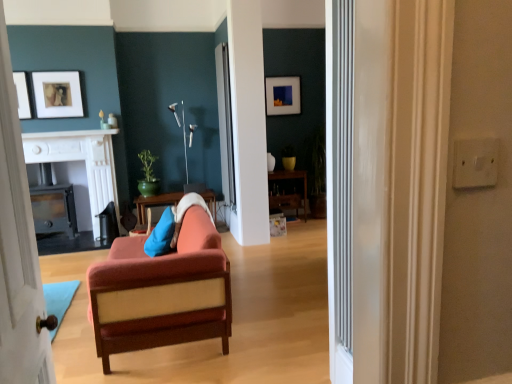
Question: Is clear glass door at center directly adjacent to white painted wood door at left?

Choices:
 (A) yes
 (B) no

Answer: (B)

Question: From the image's perspective, is clear glass door at center on white painted wood door at left?

Choices:
 (A) no
 (B) yes

Answer: (B)

Question: Does clear glass door at center have a greater height compared to white painted wood door at left?

Choices:
 (A) yes
 (B) no

Answer: (A)

Question: Considering the relative sizes of clear glass door at center and white painted wood door at left in the image provided, is clear glass door at center thinner than white painted wood door at left?

Choices:
 (A) yes
 (B) no

Answer: (A)

Question: From a real-world perspective, is clear glass door at center positioned under white painted wood door at left based on gravity?

Choices:
 (A) no
 (B) yes

Answer: (A)

Question: Does point (224, 264) appear closer or farther from the camera than point (84, 135)?

Choices:
 (A) farther
 (B) closer

Answer: (B)

Question: In the image, is velvet orange couch at center positioned in front of or behind white glossy fireplace at upper center?

Choices:
 (A) behind
 (B) front

Answer: (B)

Question: From a real-world perspective, relative to white glossy fireplace at upper center, is velvet orange couch at center vertically above or below?

Choices:
 (A) below
 (B) above

Answer: (A)

Question: Is velvet orange couch at center bigger or smaller than white glossy fireplace at upper center?

Choices:
 (A) big
 (B) small

Answer: (A)

Question: Relative to wooden cabinet at center, arranged as the 2th table when viewed from the left, is white glossy fireplace at upper center in front or behind?

Choices:
 (A) front
 (B) behind

Answer: (A)

Question: Which is correct: white glossy fireplace at upper center is inside wooden cabinet at center, which is the 1th table in right-to-left order, or outside of it?

Choices:
 (A) outside
 (B) inside

Answer: (A)

Question: From their relative heights in the image, would you say white glossy fireplace at upper center is taller or shorter than wooden cabinet at center, arranged as the 2th table when viewed from the left?

Choices:
 (A) short
 (B) tall

Answer: (A)

Question: From a real-world perspective, is white glossy fireplace at upper center physically located above or below wooden cabinet at center, arranged as the 2th table when viewed from the left?

Choices:
 (A) below
 (B) above

Answer: (B)

Question: In the image, is matte black picture frame at upper center, which is counted as the first picture frame, starting from the back, positioned in front of or behind white glossy fireplace at upper center?

Choices:
 (A) front
 (B) behind

Answer: (B)

Question: Considering the positions of matte black picture frame at upper center, positioned as the 1th picture frame in right-to-left order, and white glossy fireplace at upper center in the image, is matte black picture frame at upper center, positioned as the 1th picture frame in right-to-left order, wider or thinner than white glossy fireplace at upper center?

Choices:
 (A) wide
 (B) thin

Answer: (B)